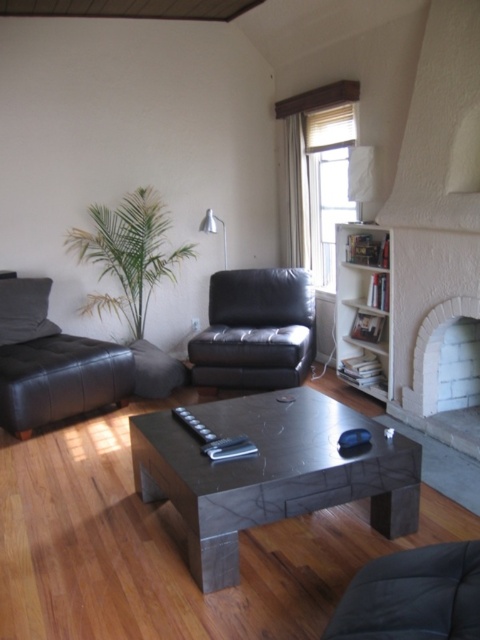
You are a delivery person trying to place a package that is 1.8 meters long between the matte black chair at lower right and the white brick fireplace at right. Can the package fit in the space between them?

The distance between the matte black chair at lower right and the white brick fireplace at right is 1.86 meters, so the 1.8 meter long package can fit in the space between them since it is shorter than the available distance.

You are arranging a new plant in the living room. You want to place it between the matte black coffee table at center and the white wooden bookshelf at right. Which side of the bookshelf should you place it on?

You should place the plant to the left side of the white wooden bookshelf at right because the matte black coffee table at center is already positioned to the left of it.

You are sitting on the sofa and looking around the living room. Which object, the matte black chair at lower right or the white brick fireplace at right, is shorter in height?

The matte black chair at lower right is shorter than the white brick fireplace at right.